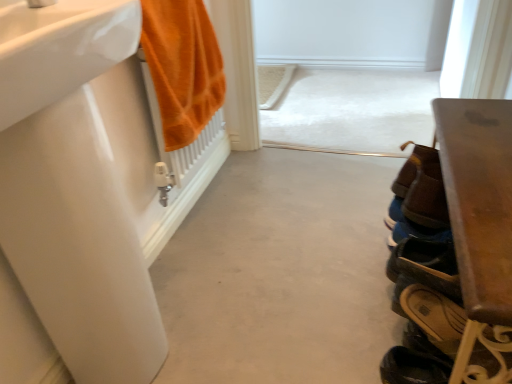
Question: Could you tell me if gray matte concrete at center is facing brown leather shoe at lower right, the first shoe positioned from the back?

Choices:
 (A) no
 (B) yes

Answer: (A)

Question: Does gray matte concrete at center appear on the right side of brown leather shoe at lower right, marked as the second shoe in a front-to-back arrangement?

Choices:
 (A) no
 (B) yes

Answer: (A)

Question: Would you consider gray matte concrete at center to be distant from brown leather shoe at lower right, the first shoe positioned from the back?

Choices:
 (A) no
 (B) yes

Answer: (A)

Question: Is gray matte concrete at center outside brown leather shoe at lower right, the first shoe positioned from the back?

Choices:
 (A) yes
 (B) no

Answer: (A)

Question: Is gray matte concrete at center surrounding brown leather shoe at lower right, marked as the second shoe in a front-to-back arrangement?

Choices:
 (A) yes
 (B) no

Answer: (B)

Question: Looking at their shapes, would you say brown leather shoe at lower right, marked as the second shoe in a front-to-back arrangement, is wider or thinner than brown leather shoe at lower right, the first shoe viewed from the front?

Choices:
 (A) thin
 (B) wide

Answer: (A)

Question: Relative to brown leather shoe at lower right, the 2th shoe when ordered from back to front, is brown leather shoe at lower right, marked as the second shoe in a front-to-back arrangement, in front or behind?

Choices:
 (A) behind
 (B) front

Answer: (A)

Question: Is brown leather shoe at lower right, marked as the second shoe in a front-to-back arrangement, spatially inside brown leather shoe at lower right, the first shoe viewed from the front, or outside of it?

Choices:
 (A) inside
 (B) outside

Answer: (B)

Question: From the image's perspective, is brown leather shoe at lower right, marked as the second shoe in a front-to-back arrangement, above or below brown leather shoe at lower right, the 2th shoe when ordered from back to front?

Choices:
 (A) below
 (B) above

Answer: (B)

Question: Is point (437, 195) closer or farther from the camera than point (116, 215)?

Choices:
 (A) closer
 (B) farther

Answer: (B)

Question: Relative to white glossy sink at left, the second sink when ordered from top to bottom, is brown leather shoe at lower right, the first shoe viewed from the front, in front or behind?

Choices:
 (A) front
 (B) behind

Answer: (B)

Question: Would you say brown leather shoe at lower right, the first shoe viewed from the front, is inside or outside white glossy sink at left, the second sink when ordered from top to bottom?

Choices:
 (A) outside
 (B) inside

Answer: (A)

Question: Considering the relative positions of brown leather shoe at lower right, the first shoe viewed from the front, and white glossy sink at left, which is counted as the 1th sink, starting from the bottom, in the image provided, is brown leather shoe at lower right, the first shoe viewed from the front, to the left or to the right of white glossy sink at left, which is counted as the 1th sink, starting from the bottom,?

Choices:
 (A) right
 (B) left

Answer: (A)

Question: From a real-world perspective, relative to orange cotton towel at left, is white glossy sink at left, acting as the first sink starting from the top, vertically above or below?

Choices:
 (A) above
 (B) below

Answer: (A)

Question: From the image's perspective, is white glossy sink at left, the second sink positioned from the bottom, located above or below orange cotton towel at left?

Choices:
 (A) above
 (B) below

Answer: (B)